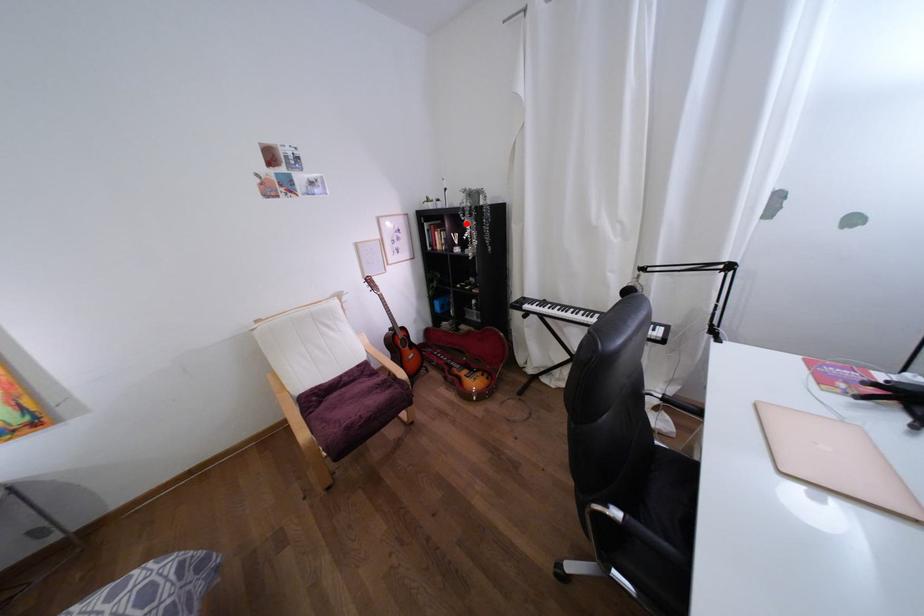
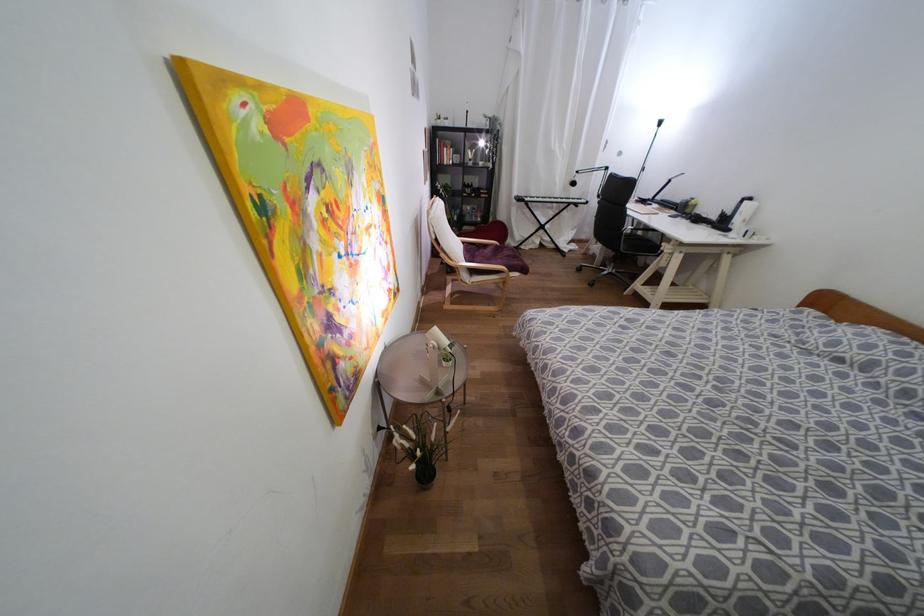
Where in the second image is the point corresponding to the highlighted location from the first image?

(480, 143)